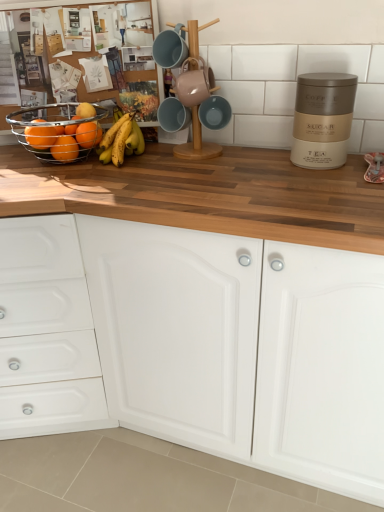
Question: From a real-world perspective, relative to orange matte at left, the first orange in the back-to-front sequence, is yellow matte bananas at center vertically above or below?

Choices:
 (A) below
 (B) above

Answer: (A)

Question: Relative to orange matte at left, the first orange in the back-to-front sequence, is yellow matte bananas at center in front or behind?

Choices:
 (A) behind
 (B) front

Answer: (B)

Question: Based on their relative distances, which object is nearer to the matte orange at left, which is the 2th orange in front-to-back order?

Choices:
 (A) orange matte at left, positioned as the fourth orange in front-to-back order
 (B) metallic wire basket at left, acting as the 4th orange starting from the back
 (C) yellow matte bananas at center
 (D) white matte cabinet at center
 (E) matte orange fruit at left, the second orange when ordered from back to front

Answer: (E)

Question: Considering the real-world distances, which object is farthest from the matte orange at left, marked as the third orange in a back-to-front arrangement?

Choices:
 (A) yellow matte bananas at center
 (B) white matte cabinet at center
 (C) metallic wire basket at left, which appears as the first orange when viewed from the front
 (D) orange matte at left, positioned as the fourth orange in front-to-back order
 (E) matte orange fruit at left, positioned as the third orange in front-to-back order

Answer: (B)